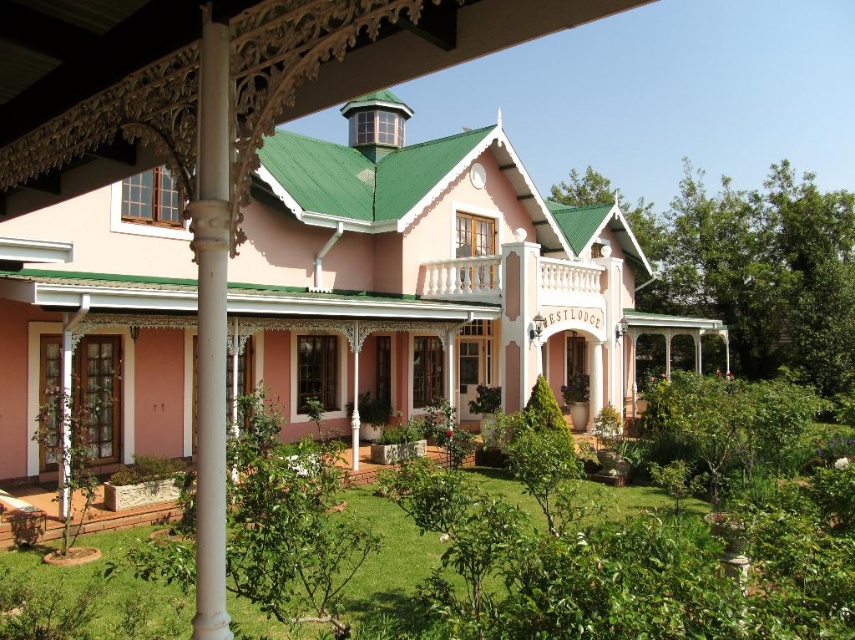
You are a landscape architect designing a garden path that needs to fit between the green leafy shrubs at center and the white carved wood column at center. If the path must be at least 1 meter wide, can you determine if there is enough space between them based on their sizes?

The green leafy shrubs at center are wider than the white carved wood column at center. Since the shrubs are wider, the space between them and the column might be narrower than the shrub width. However, without exact measurements of the distance between them, it is impossible to confirm if the path will be at least 1 meter wide. More information is needed.

You are a delivery person standing at the entrance of the house. You need to place a package between the green leafy shrubs at center and the white carved wood column at center. The package requires a space of 6 meters. Can you fit it there?

The distance between the green leafy shrubs at center and the white carved wood column at center is 6.58 meters, so yes, the package requiring 6 meters of space can fit between them since there is enough room.

You are a visitor arriving at the West Lodge and notice two elements at the center of the house. Which one is bigger between the green leafy shrubs at center and the white carved wood column at center?

The green leafy shrubs at center is larger in size than the white carved wood column at center.